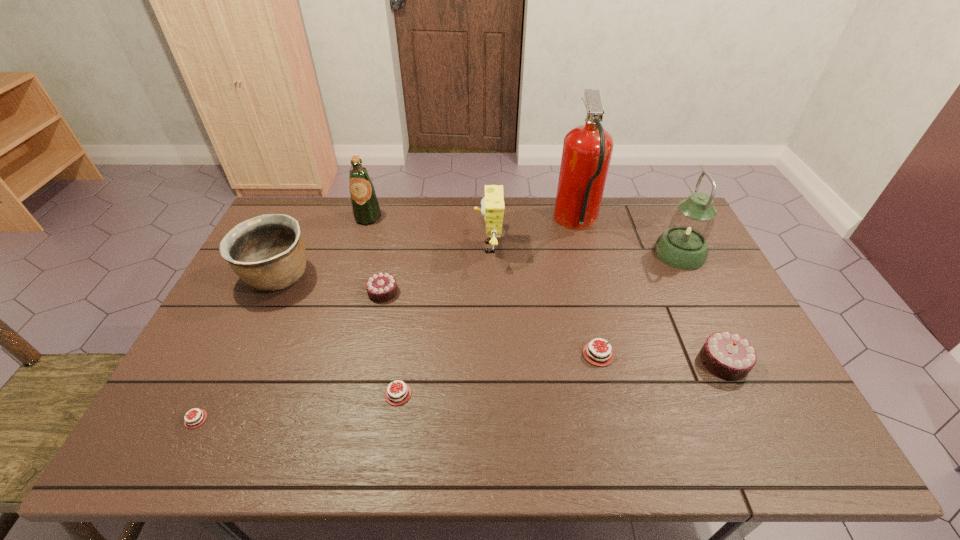
Identify which object is the closest to the fire extinguisher. Please provide its 2D coordinates. Your answer should be formatted as a tuple, i.e. [(x, y)], where the tuple contains the x and y coordinates of a point satisfying the conditions above.

[(683, 245)]

Locate an element on the screen. chocolate cake that is the fourth closest to the rightmost red chocolate cake is located at coordinates point(188,423).

Point out which chocolate cake is positioned as the fourth nearest to the rightmost chocolate cake. Please provide its 2D coordinates. Your answer should be formatted as a tuple, i.e. [(x, y)], where the tuple contains the x and y coordinates of a point satisfying the conditions above.

[(188, 423)]

Identify the location of red chocolate cake object that ranks as the third closest to the fire extinguisher. (188, 423).

Identify which red chocolate cake is located as the third nearest to the ninth shortest object. Please provide its 2D coordinates. Your answer should be formatted as a tuple, i.e. [(x, y)], where the tuple contains the x and y coordinates of a point satisfying the conditions above.

[(188, 423)]

Where is `vacant position in the image that satisfies the following two spatial constraints: 1. on the front side of the fifth tallest object; 2. on the left side of the second smallest red chocolate cake`? Image resolution: width=960 pixels, height=540 pixels. vacant position in the image that satisfies the following two spatial constraints: 1. on the front side of the fifth tallest object; 2. on the left side of the second smallest red chocolate cake is located at coordinates (224, 394).

What are the coordinates of `vacant space that satisfies the following two spatial constraints: 1. on the back side of the lantern; 2. on the front-facing side of the fifth object from right to left` in the screenshot? It's located at click(x=677, y=247).

Identify the location of vacant region that satisfies the following two spatial constraints: 1. with the handle and nozzle on the rightmost chocolate cake; 2. on the left side of the fire extinguisher. (612, 362).